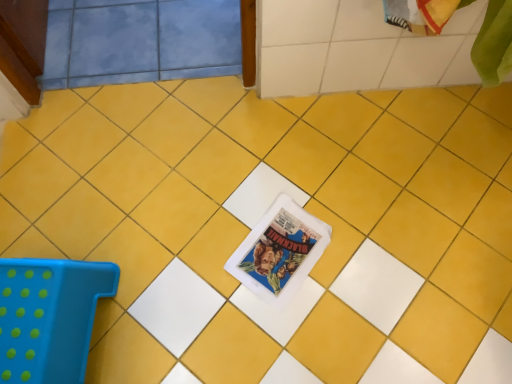
What are the coordinates of `free space behind matte plastic comic book at center` in the screenshot? It's located at (278, 182).